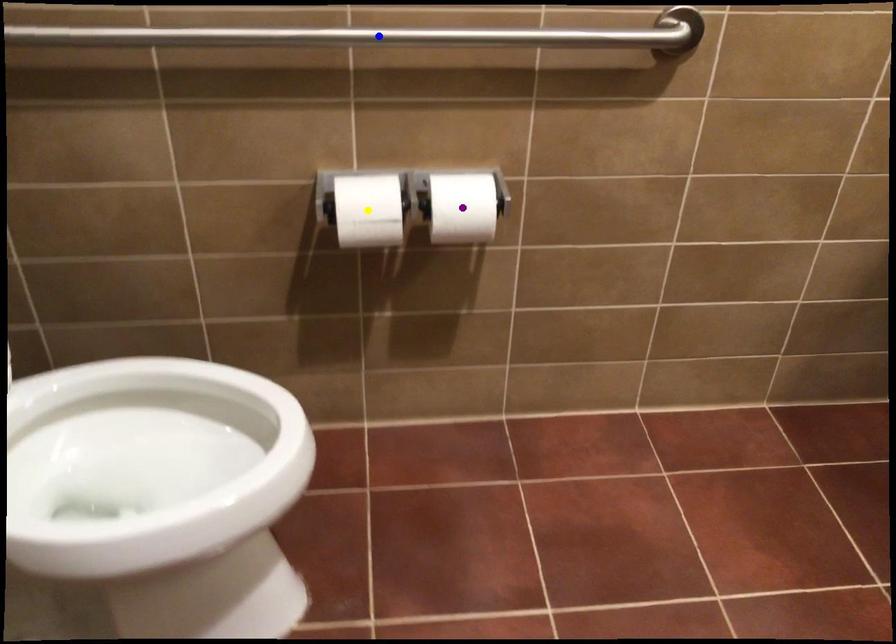
Order these from nearest to farthest:
yellow point
purple point
blue point

purple point < yellow point < blue point